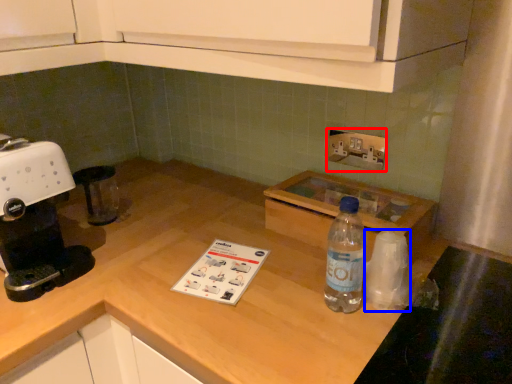
Question: Which object appears farthest to the camera in this image, electric outlet (highlighted by a red box) or paper towel (highlighted by a blue box)?

Choices:
 (A) electric outlet
 (B) paper towel

Answer: (A)